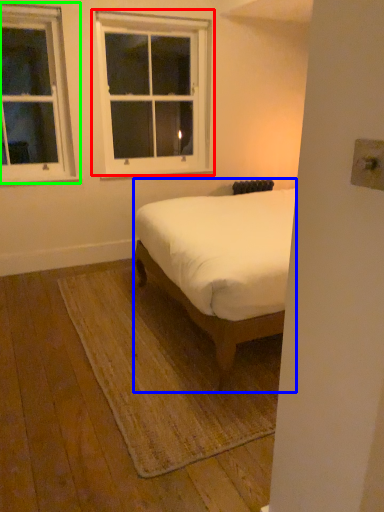
Question: Based on their relative distances, which object is farther from window (highlighted by a red box)? Choose from bed (highlighted by a blue box) and window (highlighted by a green box).

Choices:
 (A) bed
 (B) window

Answer: (A)